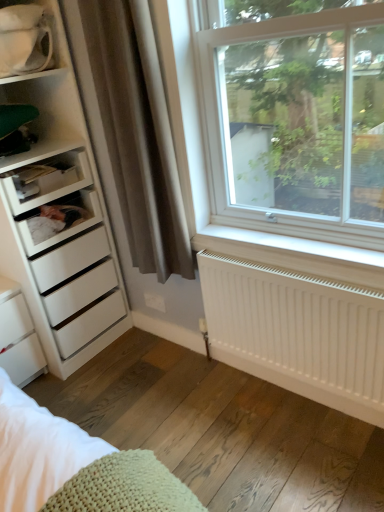
In order to click on vacant space in front of white matte radiator at lower right in this screenshot , I will do `click(287, 445)`.